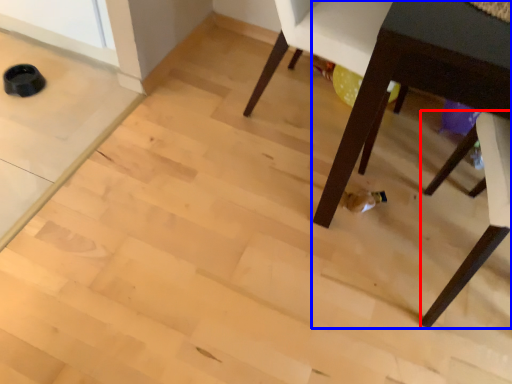
Question: Among these objects, which one is farthest to the camera, chair (highlighted by a red box) or table (highlighted by a blue box)?

Choices:
 (A) chair
 (B) table

Answer: (A)